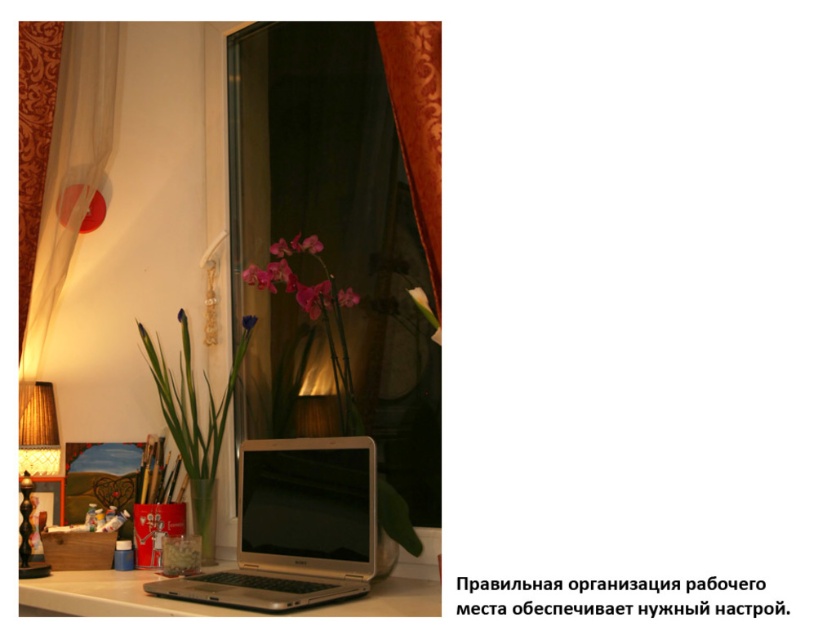
You are arranging flowers in a vase for a centerpiece. You have two orchids, a pink glossy orchid at center and a pink matte orchid at center. Which one is placed on top of the other?

The pink glossy orchid at center is positioned over the pink matte orchid at center.